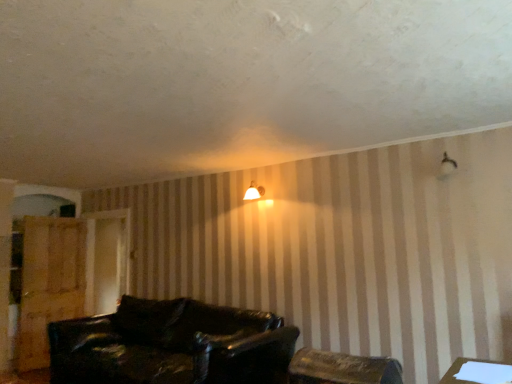
Question: Would you say white paper at lower right is inside or outside wooden chair at lower center?

Choices:
 (A) inside
 (B) outside

Answer: (B)

Question: Is white paper at lower right in front of or behind wooden chair at lower center in the image?

Choices:
 (A) front
 (B) behind

Answer: (A)

Question: Which is nearer to the wooden dresser at left?

Choices:
 (A) white paper at lower right
 (B) matte white lampshade at upper center
 (C) leather couch at lower center
 (D) wooden chair at lower center

Answer: (C)

Question: Which object is the farthest from the leather couch at lower center?

Choices:
 (A) wooden dresser at left
 (B) matte white lampshade at upper center
 (C) white paper at lower right
 (D) wooden chair at lower center

Answer: (C)